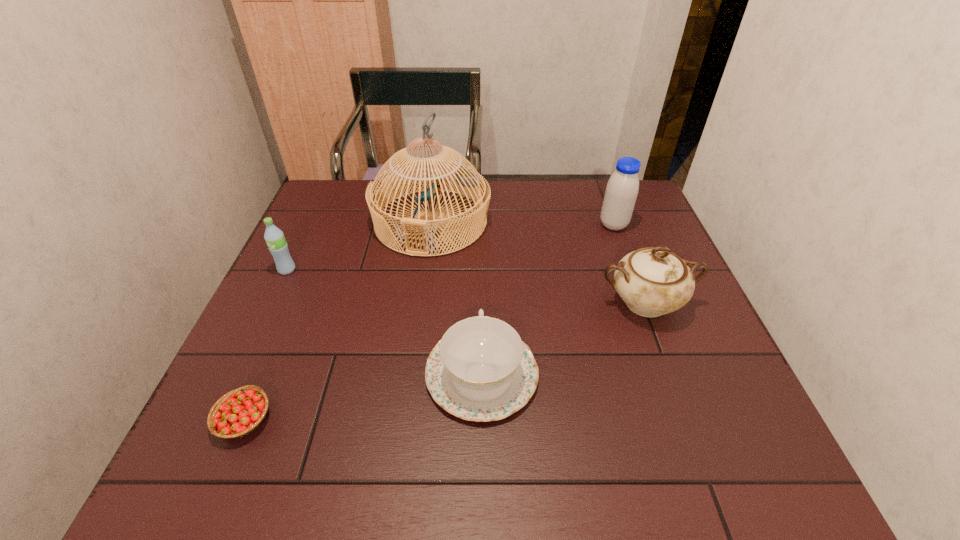
Locate an element on the screen. The width and height of the screenshot is (960, 540). strawberry that is positioned at the left edge is located at coordinates (239, 412).

Where is `soya milk that is at the right edge`? soya milk that is at the right edge is located at coordinates (622, 188).

Locate an element on the screen. chinaware located at the right edge is located at coordinates (652, 282).

At what (x,y) coordinates should I click in order to perform the action: click on object at the near left corner. Please return your answer as a coordinate pair (x, y). This screenshot has width=960, height=540. Looking at the image, I should click on (239, 412).

The height and width of the screenshot is (540, 960). I want to click on object situated at the far right corner, so click(x=622, y=188).

At what (x,y) coordinates should I click in order to perform the action: click on free spot at the far edge of the desktop. Please return your answer as a coordinate pair (x, y). This screenshot has width=960, height=540. Looking at the image, I should click on (562, 200).

This screenshot has width=960, height=540. What are the coordinates of `vacant area at the near edge of the desktop` in the screenshot? It's located at (382, 487).

This screenshot has height=540, width=960. Identify the location of free location at the left edge. (324, 227).

Locate an element on the screen. This screenshot has height=540, width=960. free location at the right edge of the desktop is located at coordinates (634, 238).

Image resolution: width=960 pixels, height=540 pixels. In the image, there is a desktop. In order to click on vacant space at the far right corner in this screenshot , I will do `click(639, 195)`.